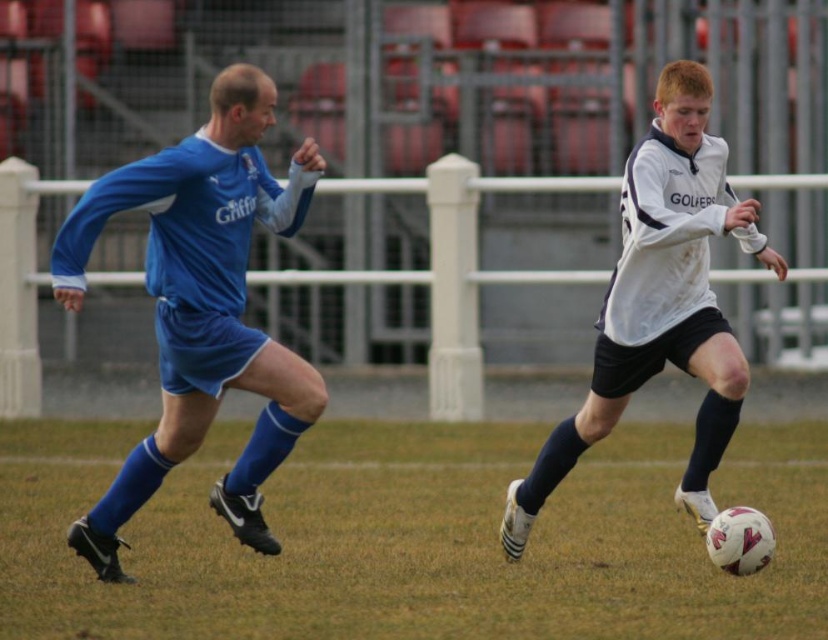
Does green grass at center have a lesser height compared to matte blue jersey at left?

Yes, green grass at center is shorter than matte blue jersey at left.

Can you confirm if green grass at center is positioned to the left of matte blue jersey at left?

No, green grass at center is not to the left of matte blue jersey at left.

Based on the photo, who is more distant from viewer, [47,518] or [205,237]?

The point [47,518] is more distant.

What are the coordinates of `green grass at center` in the screenshot? It's located at (414, 538).

What do you see at coordinates (201, 307) in the screenshot? I see `matte blue jersey at left` at bounding box center [201, 307].

Between matte blue jersey at left and white matte soccer ball at center, which one has less height?

With less height is matte blue jersey at left.

Who is more distant from viewer, (x=225, y=289) or (x=706, y=179)?

The point (x=706, y=179) is behind.

Image resolution: width=828 pixels, height=640 pixels. Identify the location of matte blue jersey at left. click(x=201, y=307).

From the picture: Is green grass at center wider than white matte soccer ball at center?

No.

Does green grass at center come behind white matte soccer ball at center?

Yes.

Which is in front, point (443, 573) or point (650, 136)?

Point (650, 136) is in front.

The height and width of the screenshot is (640, 828). I want to click on green grass at center, so click(x=414, y=538).